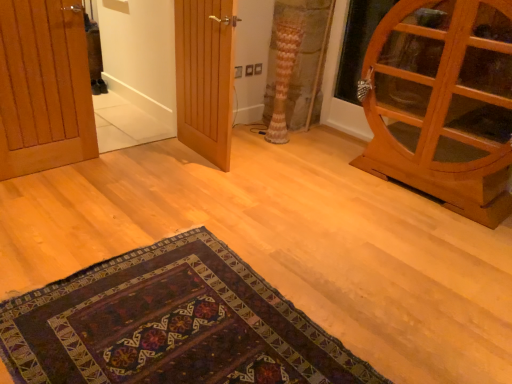
Question: In terms of width, does wooden door at left, placed as the third door when sorted from right to left, look wider or thinner when compared to wooden door at center, the second door in the right-to-left sequence?

Choices:
 (A) wide
 (B) thin

Answer: (B)

Question: In terms of size, does wooden door at left, the 1th door from the left, appear bigger or smaller than wooden door at center, the 2th door when ordered from left to right?

Choices:
 (A) big
 (B) small

Answer: (B)

Question: Which object is positioned closest to the wooden door at center, the 2th door when ordered from left to right?

Choices:
 (A) wooden door at left, the 1th door from the left
 (B) wooden cabinet at right, positioned as the 1th door in right-to-left order
 (C) patterned fabric curtain at center
 (D) dark woven rug at lower center

Answer: (C)

Question: Estimate the real-world distances between objects in this image. Which object is farther from the patterned fabric curtain at center?

Choices:
 (A) dark woven rug at lower center
 (B) wooden door at left, the 1th door from the left
 (C) wooden door at center, the second door in the right-to-left sequence
 (D) wooden cabinet at right, which is counted as the 3th door, starting from the left

Answer: (A)